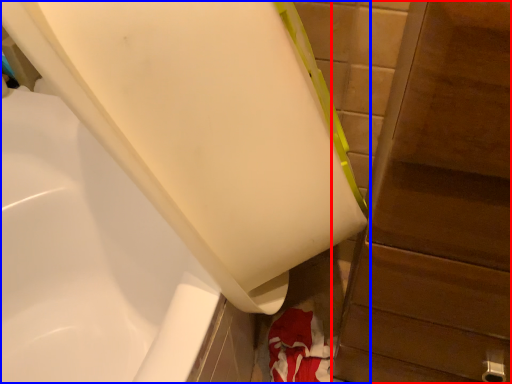
Question: Which object is further to the camera taking this photo, dresser (highlighted by a red box) or bathtub (highlighted by a blue box)?

Choices:
 (A) dresser
 (B) bathtub

Answer: (B)